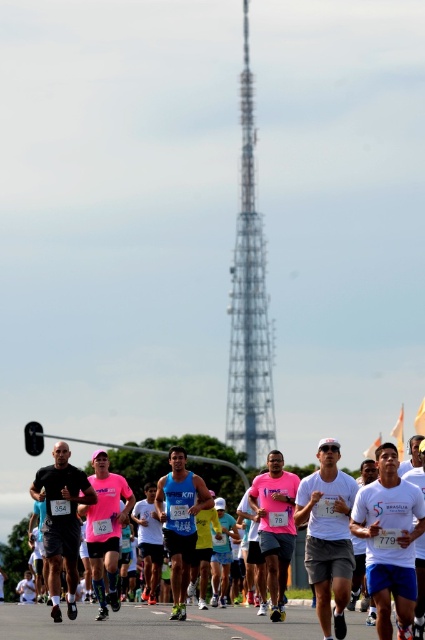
Does metallic silver tower at center have a lesser height compared to white matte shirt at center?

No, metallic silver tower at center is not shorter than white matte shirt at center.

Can you confirm if metallic silver tower at center is positioned above white matte shirt at center?

Indeed, metallic silver tower at center is positioned over white matte shirt at center.

You are a GUI agent. You are given a task and a screenshot of the screen. Output one action in this format:
    pyautogui.click(x=<x>, y=<y>)
    Task: Click on the metallic silver tower at center
    This screenshot has height=640, width=425.
    Given the screenshot: What is the action you would take?
    pyautogui.click(x=249, y=301)